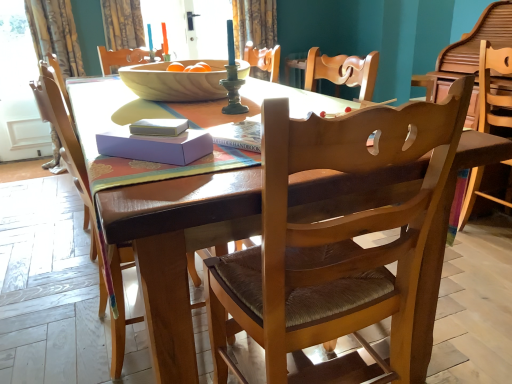
Describe the element at coordinates (156, 146) in the screenshot. I see `lavender cardboard box at center` at that location.

Locate an element on the screen. Image resolution: width=512 pixels, height=384 pixels. curtain at upper left is located at coordinates (122, 24).

What do you see at coordinates (489, 86) in the screenshot?
I see `wooden chair at right, the first chair from the right` at bounding box center [489, 86].

The image size is (512, 384). What are the coordinates of `wooden chair with woven seat at center, acting as the second chair starting from the left` in the screenshot? It's located at (334, 238).

Locate an element on the screen. The height and width of the screenshot is (384, 512). wooden bowl at center is located at coordinates (175, 82).

Locate an element on the screen. lavender cardboard box at center is located at coordinates (156, 146).

The width and height of the screenshot is (512, 384). Identify the location of box in front of the curtain at upper left. (156, 146).

Does lavender cardboard box at center appear on the right side of curtain at upper left?

Yes, lavender cardboard box at center is to the right of curtain at upper left.

Is lavender cardboard box at center not close to curtain at upper left?

Indeed, lavender cardboard box at center is not near curtain at upper left.

Considering the sizes of objects lavender cardboard box at center and curtain at upper left in the image provided, who is wider, lavender cardboard box at center or curtain at upper left?

curtain at upper left.

Could you tell me if wooden bowl at center is facing wooden table at center?

No, wooden bowl at center does not turn towards wooden table at center.

Is wooden bowl at center shorter than wooden table at center?

Indeed, wooden bowl at center has a lesser height compared to wooden table at center.

Is wooden bowl at center bigger than wooden table at center?

Actually, wooden bowl at center might be smaller than wooden table at center.

From the picture: How many degrees apart are the facing directions of wooden bowl at center and wooden table at center?

The angle between the facing direction of wooden bowl at center and the facing direction of wooden table at center is 0.871 degrees.

From a real-world perspective, who is located lower, wooden chair at left, the 1th chair from the left, or wooden table at center?

wooden table at center.

Image resolution: width=512 pixels, height=384 pixels. I want to click on the 3rd chair positioned above the wooden table at center (from a real-world perspective), so click(x=68, y=149).

Which is correct: wooden chair at left, the 1th chair from the left, is inside wooden table at center, or outside of it?

wooden chair at left, the 1th chair from the left, is enclosed within wooden table at center.

Can we say wooden chair at left, which is the third chair from right to left, lies outside wooden chair with woven seat at center, acting as the second chair starting from the left?

Absolutely, wooden chair at left, which is the third chair from right to left, is external to wooden chair with woven seat at center, acting as the second chair starting from the left.

Can you confirm if wooden chair at left, the 1th chair from the left, is wider than wooden chair with woven seat at center, which is counted as the second chair, starting from the right?

Yes, wooden chair at left, the 1th chair from the left, is wider than wooden chair with woven seat at center, which is counted as the second chair, starting from the right.

Is wooden chair at left, which is the third chair from right to left, facing towards wooden chair with woven seat at center, acting as the second chair starting from the left?

No.

From the image's perspective, which object appears higher, wooden chair at left, which is the third chair from right to left, or wooden chair with woven seat at center, acting as the second chair starting from the left?

wooden chair at left, which is the third chair from right to left, appears higher in the image.

From the image's perspective, which one is positioned lower, wooden table at center or wooden chair at left, the 1th chair from the left?

wooden chair at left, the 1th chair from the left, is shown below in the image.

You are a GUI agent. You are given a task and a screenshot of the screen. Output one action in this format:
    pyautogui.click(x=<x>, y=<y>)
    Task: Click on the chair located on the left of wooden table at center
    Image resolution: width=512 pixels, height=384 pixels.
    Given the screenshot: What is the action you would take?
    pyautogui.click(x=68, y=149)

From a real-world perspective, which object rests below the other?

wooden table at center, from a real-world perspective.

Can you tell me how much wooden table at center and wooden chair at left, which is the third chair from right to left, differ in facing direction?

There is a 179-degree angle between the facing directions of wooden table at center and wooden chair at left, which is the third chair from right to left.

Which is correct: white paper book at center is inside wooden chair at left, which is the third chair from right to left, or outside of it?

white paper book at center is located beyond the bounds of wooden chair at left, which is the third chair from right to left.

Does white paper book at center lie in front of wooden chair at left, which is the third chair from right to left?

Yes, the depth of white paper book at center is less than that of wooden chair at left, which is the third chair from right to left.

Is white paper book at center wider than wooden chair at left, which is the third chair from right to left?

No, white paper book at center is not wider than wooden chair at left, which is the third chair from right to left.

Considering the relative sizes of white paper book at center and wooden chair at left, which is the third chair from right to left, in the image provided, is white paper book at center shorter than wooden chair at left, which is the third chair from right to left,?

Yes, white paper book at center is shorter than wooden chair at left, which is the third chair from right to left.

Is wooden bowl at center further to camera compared to curtain at upper left?

No, wooden bowl at center is closer to the viewer.

Is wooden bowl at center with curtain at upper left?

wooden bowl at center and curtain at upper left are not in contact.

From the image's perspective, which one is positioned higher, wooden bowl at center or curtain at upper left?

curtain at upper left is shown above in the image.

From a real-world perspective, relative to curtain at upper left, is wooden bowl at center vertically above or below?

Clearly, from a real-world perspective, wooden bowl at center is below curtain at upper left.

Find the location of a particular element. The image size is (512, 384). curtain behind the lavender cardboard box at center is located at coordinates (122, 24).

Image resolution: width=512 pixels, height=384 pixels. Find the location of `bowl that appears above the wooden table at center (from a real-world perspective)`. bowl that appears above the wooden table at center (from a real-world perspective) is located at coordinates (175, 82).

Based on their spatial positions, is wooden chair with woven seat at center, which is counted as the second chair, starting from the right, or wooden table at center further from white paper book at center?

wooden chair with woven seat at center, which is counted as the second chair, starting from the right.

From the image, which object appears to be nearer to white paper book at center, wooden table at center or curtain at upper left?

wooden table at center lies closer to white paper book at center than the other object.

Based on their spatial positions, is white paper book at center or wooden bowl at center further from lavender cardboard box at center?

Based on the image, wooden bowl at center appears to be further to lavender cardboard box at center.

From the image, which object appears to be nearer to lavender cardboard box at center, wooden chair at right, the first chair from the right, or wooden bowl at center?

Among the two, wooden bowl at center is located nearer to lavender cardboard box at center.

Looking at the image, which one is located closer to wooden table at center, wooden chair with woven seat at center, acting as the second chair starting from the left, or curtain at upper left?

wooden chair with woven seat at center, acting as the second chair starting from the left, lies closer to wooden table at center than the other object.

Estimate the real-world distances between objects in this image. Which object is further from lavender cardboard box at center, curtain at upper left or wooden chair at right, arranged as the 3th chair when viewed from the left?

curtain at upper left.

Considering their positions, is wooden chair with woven seat at center, which is counted as the second chair, starting from the right, positioned closer to curtain at upper left than wooden chair at left, which is the third chair from right to left?

Based on the image, wooden chair at left, which is the third chair from right to left, appears to be nearer to curtain at upper left.

From the image, which object appears to be nearer to lavender cardboard box at center, wooden chair with woven seat at center, acting as the second chair starting from the left, or wooden chair at left, which is the third chair from right to left?

wooden chair at left, which is the third chair from right to left, is positioned closer to the anchor lavender cardboard box at center.

Identify the location of box situated between wooden chair at left, which is the third chair from right to left, and wooden chair at right, arranged as the 3th chair when viewed from the left, from left to right. The height and width of the screenshot is (384, 512). (156, 146).

In order to click on book between wooden chair with woven seat at center, which is counted as the second chair, starting from the right, and curtain at upper left, along the z-axis in this screenshot , I will do `click(159, 127)`.

You are a GUI agent. You are given a task and a screenshot of the screen. Output one action in this format:
    pyautogui.click(x=<x>, y=<y>)
    Task: Click on the book between wooden bowl at center and wooden chair at left, which is the third chair from right to left, vertically
    
    Given the screenshot: What is the action you would take?
    pyautogui.click(x=159, y=127)

This screenshot has width=512, height=384. Identify the location of chair between wooden chair with woven seat at center, which is counted as the second chair, starting from the right, and wooden bowl at center, along the z-axis. (68, 149).